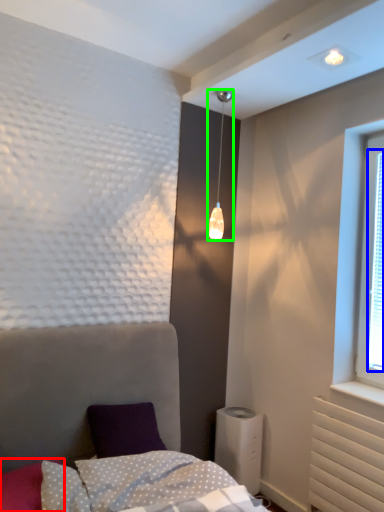
Question: Which object is the farthest from pillow (highlighted by a red box)? Choose among these: window screen (highlighted by a blue box) or lamp (highlighted by a green box).

Choices:
 (A) window screen
 (B) lamp

Answer: (A)